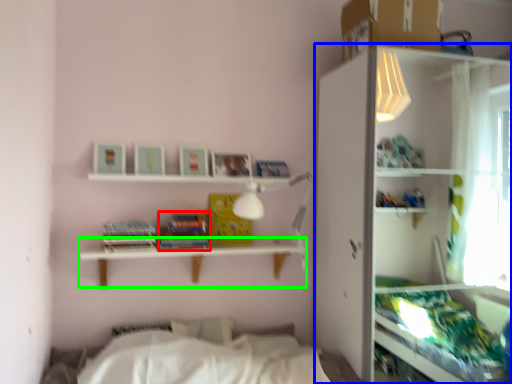
Question: Estimate the real-world distances between objects in this image. Which object is farther from paperback book (highlighted by a red box), shelf (highlighted by a blue box) or table (highlighted by a green box)?

Choices:
 (A) shelf
 (B) table

Answer: (A)